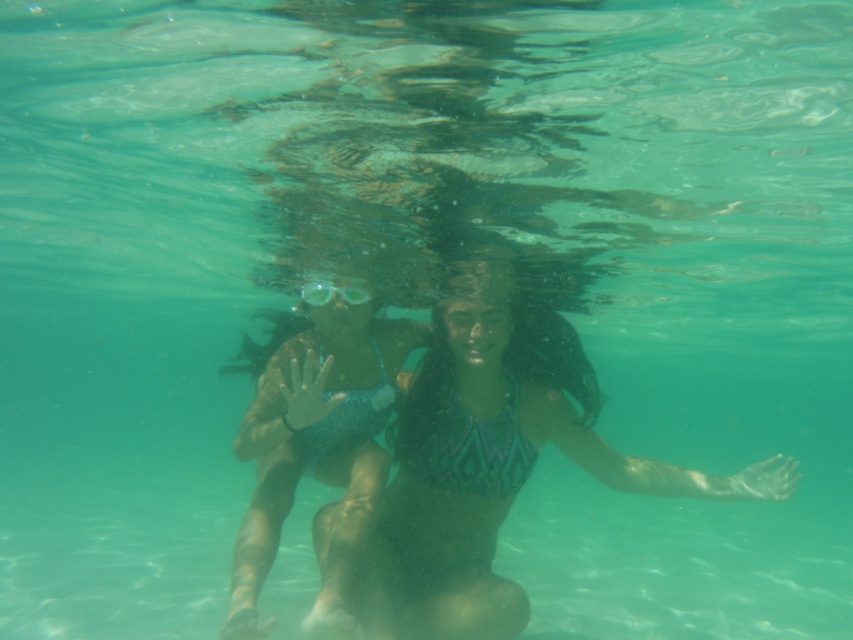
Question: Does blue-green swimsuit at center have a lesser width compared to clear plastic goggles at center?

Choices:
 (A) no
 (B) yes

Answer: (A)

Question: Which object is farther from the camera taking this photo?

Choices:
 (A) blue-green swimsuit at center
 (B) teal textured bikini at center
 (C) teal fabric bikini at center

Answer: (B)

Question: Can you confirm if teal fabric bikini at center is thinner than green textured bikini top at center?

Choices:
 (A) no
 (B) yes

Answer: (A)

Question: Which object is positioned farthest from the teal textured bikini at center?

Choices:
 (A) clear plastic goggles at center
 (B) green textured bikini top at center
 (C) blue-green swimsuit at center
 (D) teal fabric bikini at center

Answer: (A)

Question: Which object is positioned farthest from the teal fabric bikini at center?

Choices:
 (A) blue-green swimsuit at center
 (B) teal textured bikini at center

Answer: (A)

Question: Is teal fabric bikini at center further to the viewer compared to green textured bikini top at center?

Choices:
 (A) no
 (B) yes

Answer: (A)